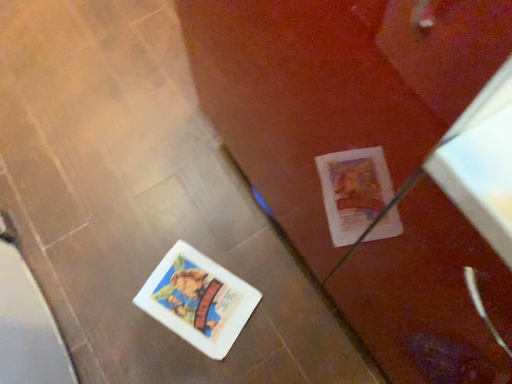
This screenshot has height=384, width=512. I want to click on white glossy magazine at lower left, so click(198, 300).

This screenshot has width=512, height=384. What do you see at coordinates (198, 300) in the screenshot?
I see `white glossy magazine at lower left` at bounding box center [198, 300].

What is the approximate width of white glossy magazine at lower left?

white glossy magazine at lower left is 11.83 inches in width.

At what (x,y) coordinates should I click in order to perform the action: click on white glossy magazine at lower left. Please return your answer as a coordinate pair (x, y). The image size is (512, 384). Looking at the image, I should click on (198, 300).